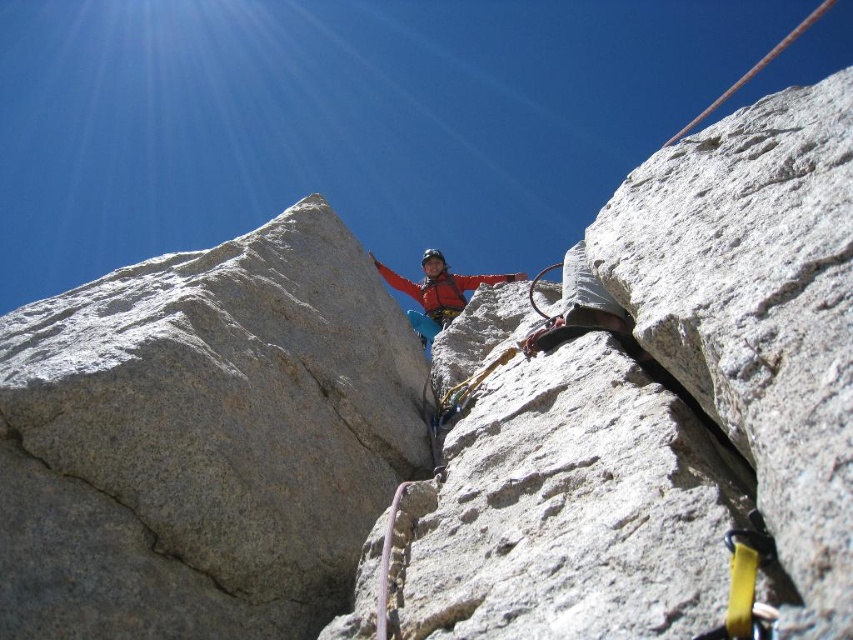
You are a climber looking up at the rock face. Which object is taller, the white granite rock at center or the matte red jacket at center?

The white granite rock at center has a greater height compared to the matte red jacket at center.

You are a photographer standing at the base of the cliff and want to capture the climbers on the gray granite rock at center. If your camera can focus up to 30 meters, will you be able to take a clear photo of the climbers?

The gray granite rock at center is 27.18 meters away from the camera. Since the camera can focus up to 30 meters, the distance is within range, so yes, you can take a clear photo of the climbers.

You are a photographer positioned below the climbers. You want to take a photo of the matte red jacket at center without the gray granite rock at center blocking it. Is this possible based on their positions?

The gray granite rock at center is in front of the matte red jacket at center, so it is blocking the view. Therefore, you cannot take a photo of the matte red jacket at center without the gray granite rock at center blocking it.